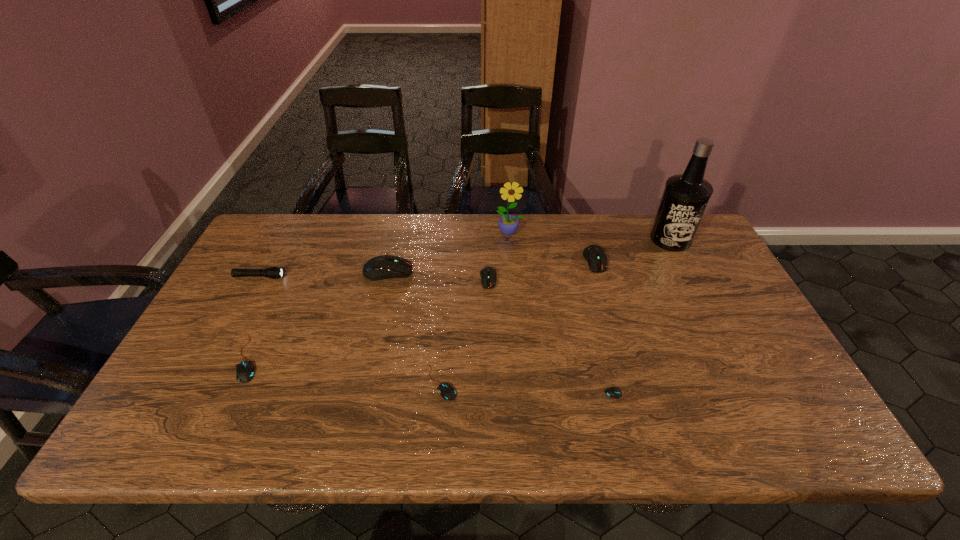
In order to click on vacant position located 0.320m on the button of the rightmost dark computer equipment in this screenshot , I will do [x=624, y=361].

Find the location of a particular element. The height and width of the screenshot is (540, 960). vacant space situated 0.360m at the lens end of the flashlight is located at coordinates (405, 277).

Image resolution: width=960 pixels, height=540 pixels. What are the coordinates of `free space located on the button of the fifth object from right to left` in the screenshot? It's located at (490, 324).

The width and height of the screenshot is (960, 540). In order to click on vacant space situated 0.330m on the right of the seventh tallest object in this screenshot , I will do `click(394, 359)`.

Find the location of a particular element. Image resolution: width=960 pixels, height=540 pixels. vacant space located 0.320m on the right of the second smallest black mouse is located at coordinates (591, 382).

At what (x,y) coordinates should I click in order to perform the action: click on vacant area situated 0.350m on the back of the rightmost black mouse. Please return your answer as a coordinate pair (x, y). Looking at the image, I should click on (593, 285).

Where is `liquor that is at the far edge`? The width and height of the screenshot is (960, 540). liquor that is at the far edge is located at coordinates (685, 197).

In order to click on sunflower present at the far edge in this screenshot , I will do `click(508, 224)`.

This screenshot has width=960, height=540. Find the location of `computer equipment located in the far edge section of the desktop`. computer equipment located in the far edge section of the desktop is located at coordinates (595, 256).

Locate an element on the screen. The width and height of the screenshot is (960, 540). flashlight that is positioned at the left edge is located at coordinates (273, 272).